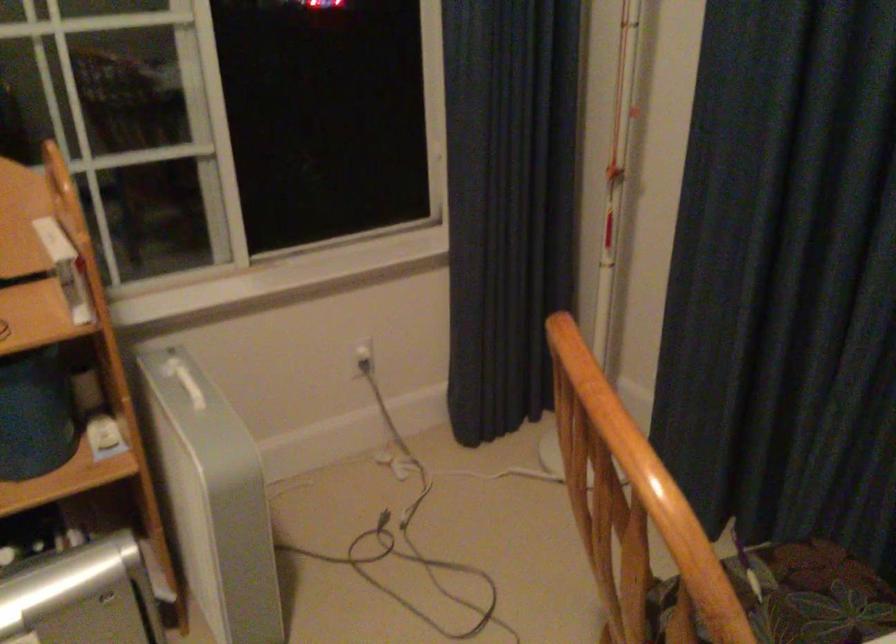
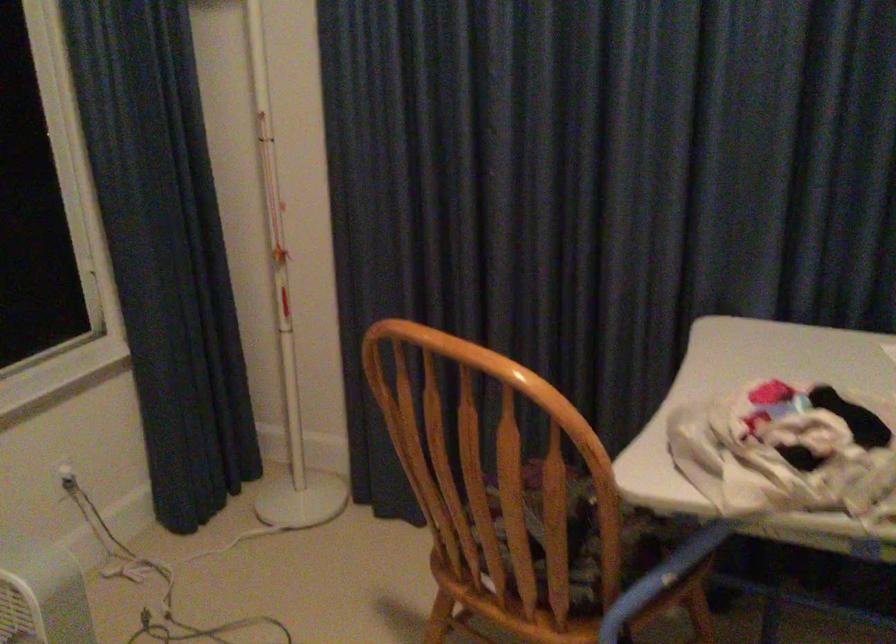
Where in the second image is the point corresponding to point 354,363 from the first image?

(65, 478)